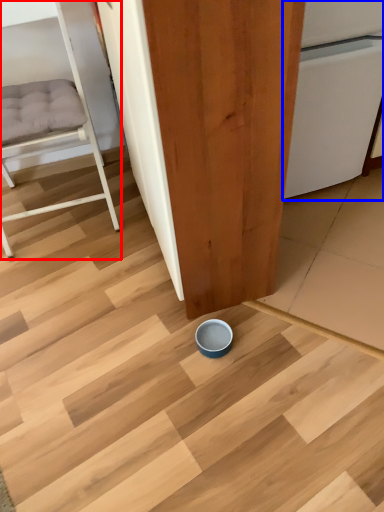
Question: Among these objects, which one is farthest to the camera, furniture (highlighted by a red box) or dish washer (highlighted by a blue box)?

Choices:
 (A) furniture
 (B) dish washer

Answer: (B)